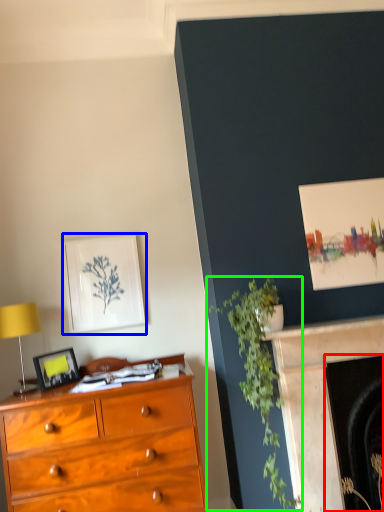
Question: Considering the real-world distances, which object is closest to fireplace (highlighted by a red box)? picture frame (highlighted by a blue box) or plant (highlighted by a green box).

Choices:
 (A) picture frame
 (B) plant

Answer: (B)